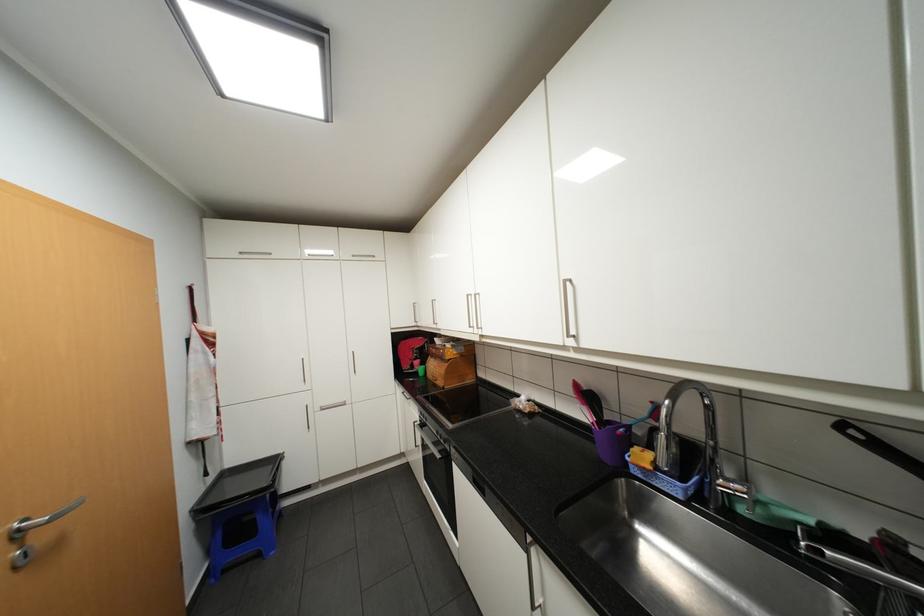
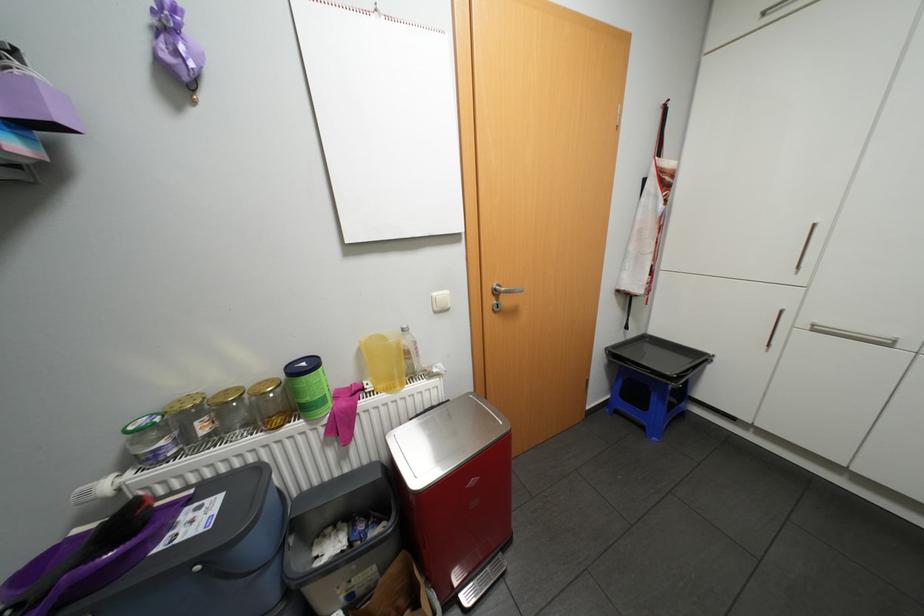
In the scene shown: The first image is from the beginning of the video and the second image is from the end. How did the camera likely rotate when shooting the video?

The camera rotated toward left-down.